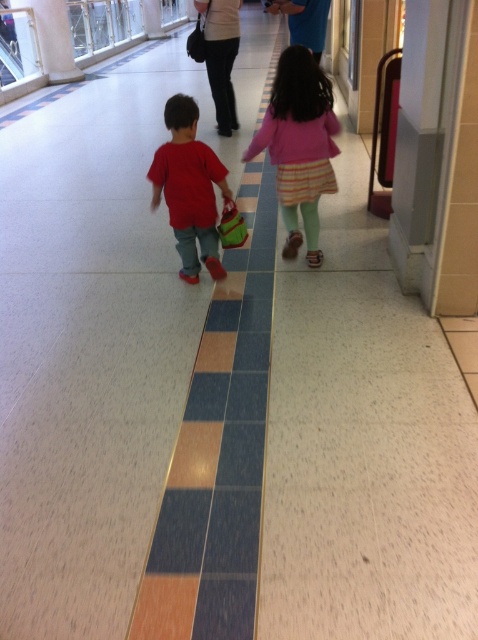
You are a photographer standing in the hallway and want to take a picture of both the matte pink sweater at center and the matte red shirt at center. Which object should you focus on first to ensure it appears in the foreground?

The matte pink sweater at center is taller than the matte red shirt at center, so you should focus on the matte pink sweater at center first to ensure it appears in the foreground.

You are a photographer standing in the hallway and want to take a photo of both the matte pink sweater at center and the matte red shirt at center. Can you fit both into your camera frame if your camera has a minimum required distance of 25 inches between objects to capture them clearly?

The matte pink sweater at center and matte red shirt at center are 27.37 inches apart, which exceeds the camera frame requirement of 25 inches, so both can be captured clearly.

From the picture: You are standing in the hallway and want to walk towards the point that is closer to the camera. Which point should you walk towards, point (283,179) or point (197,204)?

You should walk towards point (197,204) because it is closer to the camera than point (283,179).